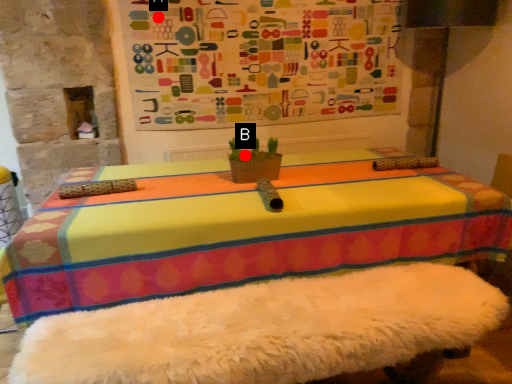
Question: Two points are circled on the image, labeled by A and B beside each circle. Which point appears farthest from the camera in this image?

Choices:
 (A) A is further
 (B) B is further

Answer: (A)